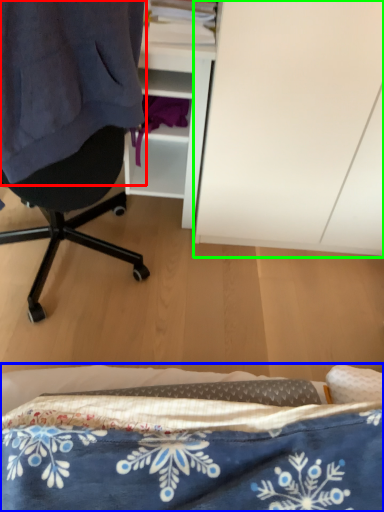
Question: Which object is the closest to the clothing (highlighted by a red box)? Choose among these: bed (highlighted by a blue box) or cabinetry (highlighted by a green box).

Choices:
 (A) bed
 (B) cabinetry

Answer: (B)